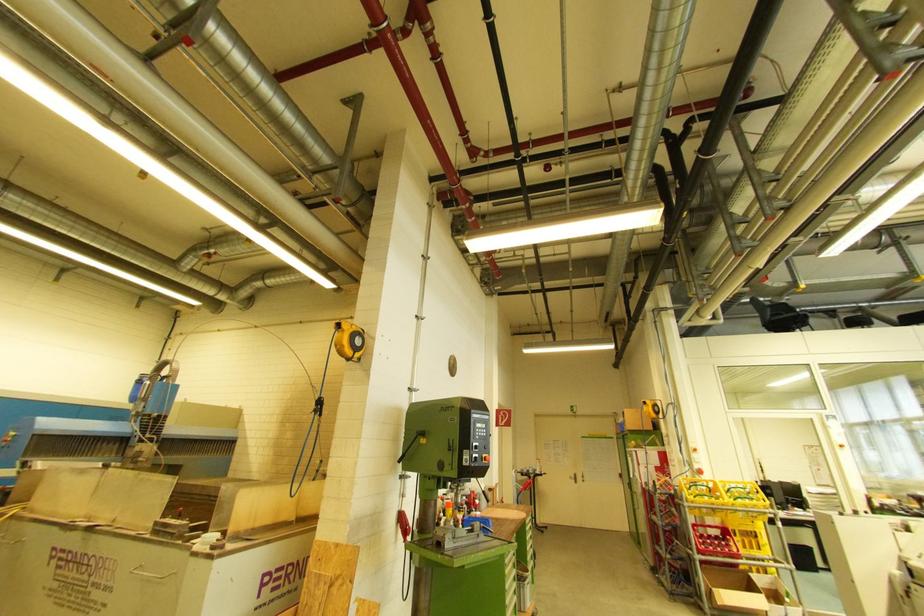
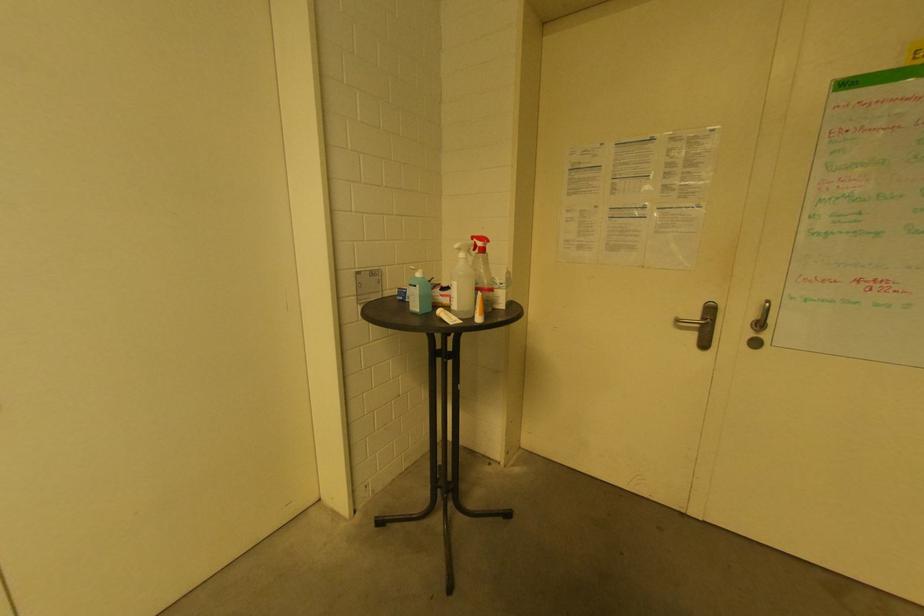
Find the pixel in the second image that matches point 585,479 in the first image.

(761, 326)